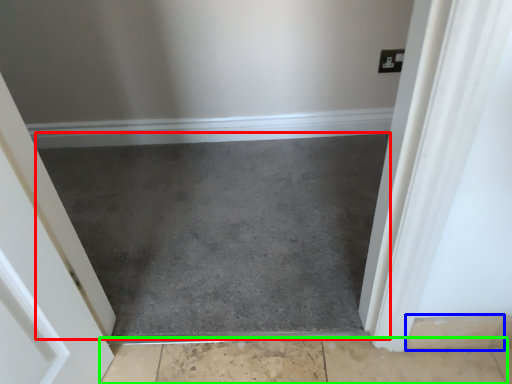
Question: Which is nearer to the slate (highlighted by a red box)? concrete (highlighted by a blue box) or concrete (highlighted by a green box).

Choices:
 (A) concrete
 (B) concrete

Answer: (B)